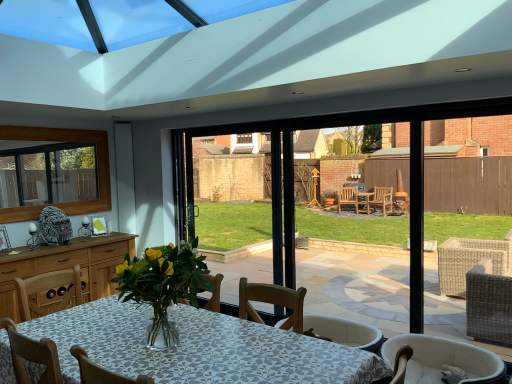
Question: Is wooden frame at upper left to the left of white fabric chair at lower right from the viewer's perspective?

Choices:
 (A) no
 (B) yes

Answer: (B)

Question: Can you confirm if wooden frame at upper left is positioned to the right of white fabric chair at lower right?

Choices:
 (A) yes
 (B) no

Answer: (B)

Question: From a real-world perspective, is wooden frame at upper left located beneath white fabric chair at lower right?

Choices:
 (A) yes
 (B) no

Answer: (B)

Question: Can you confirm if wooden frame at upper left is wider than white fabric chair at lower right?

Choices:
 (A) yes
 (B) no

Answer: (B)

Question: Considering the relative sizes of wooden frame at upper left and white fabric chair at lower right in the image provided, is wooden frame at upper left bigger than white fabric chair at lower right?

Choices:
 (A) yes
 (B) no

Answer: (B)

Question: Is wooden frame at upper left not close to white fabric chair at lower right?

Choices:
 (A) yes
 (B) no

Answer: (A)

Question: Is white fabric chair at lower right far away from wooden frame at upper left?

Choices:
 (A) no
 (B) yes

Answer: (B)

Question: Considering the relative sizes of white fabric chair at lower right and wooden frame at upper left in the image provided, is white fabric chair at lower right smaller than wooden frame at upper left?

Choices:
 (A) yes
 (B) no

Answer: (B)

Question: Considering the relative sizes of white fabric chair at lower right and wooden frame at upper left in the image provided, is white fabric chair at lower right bigger than wooden frame at upper left?

Choices:
 (A) no
 (B) yes

Answer: (B)

Question: Could you tell me if white fabric chair at lower right is turned towards wooden frame at upper left?

Choices:
 (A) yes
 (B) no

Answer: (B)

Question: Is white fabric chair at lower right facing away from wooden frame at upper left?

Choices:
 (A) no
 (B) yes

Answer: (A)

Question: Does white fabric chair at lower right lie in front of wooden frame at upper left?

Choices:
 (A) no
 (B) yes

Answer: (B)

Question: Is point (74, 135) positioned closer to the camera than point (483, 375)?

Choices:
 (A) closer
 (B) farther

Answer: (B)